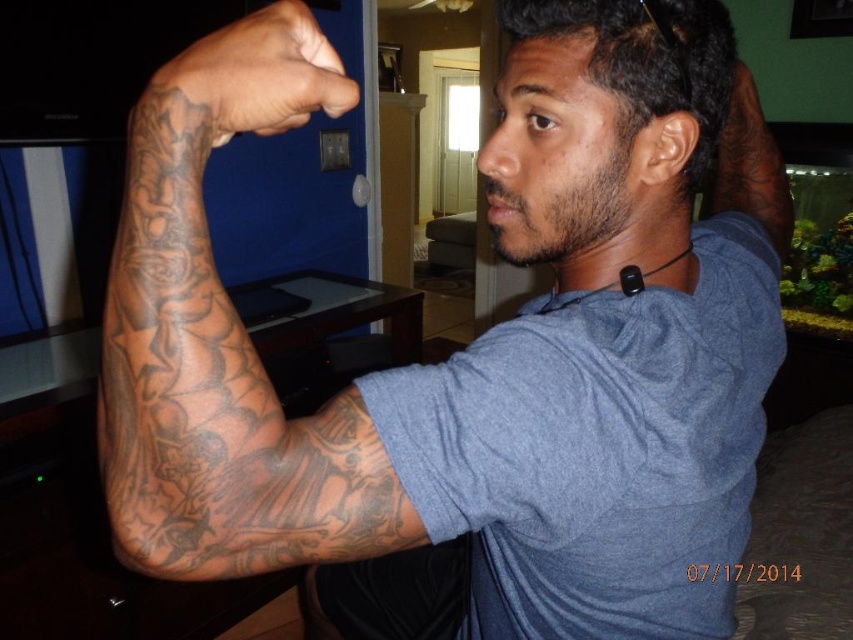
How far apart are black tattooed arm at left and dark skin tattooed hand at upper left?

The distance of black tattooed arm at left from dark skin tattooed hand at upper left is 4.01 inches.

Is point (326, 88) positioned after point (177, 108)?

Yes, point (326, 88) is behind point (177, 108).

What are the coordinates of `black tattooed arm at left` in the screenshot? It's located at (219, 372).

Is blue heathered t-shirt at upper right in front of black tattooed arm at upper right?

Yes, it is.

Measure the distance between point [432,536] and camera.

A: Point [432,536] and camera are 19.54 inches apart from each other.

Consider the image. Who is more distant from viewer, (737, 305) or (723, 148)?

The point (723, 148) is behind.

Locate an element on the screen. blue heathered t-shirt at upper right is located at coordinates (598, 449).

Is point (259, 531) more distant than point (786, 186)?

No, (259, 531) is in front of (786, 186).

Who is more forward, (183, 540) or (733, 116)?

Point (183, 540) is more forward.

Where is `black tattooed arm at left`? black tattooed arm at left is located at coordinates (219, 372).